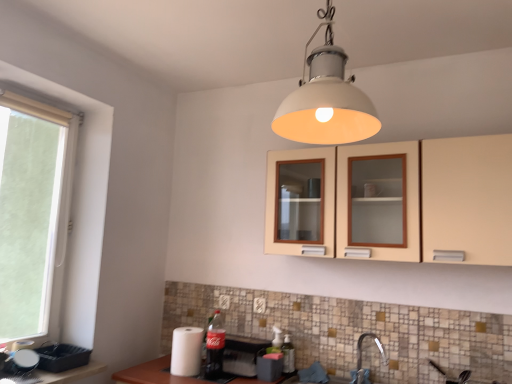
You are a GUI agent. You are given a task and a screenshot of the screen. Output one action in this format:
    pyautogui.click(x=<x>, y=<y>)
    Task: Click on the satin nickel faucet at lower center
    The height and width of the screenshot is (384, 512).
    Given the screenshot: What is the action you would take?
    pyautogui.click(x=361, y=354)

What is the approximate height of matte plastic tray at lower left?

matte plastic tray at lower left is 1.48 inches tall.

What do you see at coordinates (57, 375) in the screenshot? This screenshot has width=512, height=384. I see `matte plastic tray at lower left` at bounding box center [57, 375].

The height and width of the screenshot is (384, 512). Identify the location of white plastic electric outlet at lower center, which ranks as the first electric outlet in left-to-right order. (224, 302).

Image resolution: width=512 pixels, height=384 pixels. What do you see at coordinates (268, 367) in the screenshot? I see `matte black toaster at lower center, the 3th appliance from the left` at bounding box center [268, 367].

Where is `beige matte cabinet at upper center`? Image resolution: width=512 pixels, height=384 pixels. beige matte cabinet at upper center is located at coordinates (394, 201).

What are the coordinates of `matte black tray at lower left, acting as the first appliance starting from the left` in the screenshot? It's located at (62, 357).

Locate an element on the screen. This screenshot has height=384, width=512. satin nickel faucet at lower center is located at coordinates (361, 354).

Is beige matte cabinet at upper center oriented away from white plastic electric outlet at center, the first electric outlet in the right-to-left sequence?

beige matte cabinet at upper center is not turned away from white plastic electric outlet at center, the first electric outlet in the right-to-left sequence.

How many degrees apart are the facing directions of beige matte cabinet at upper center and white plastic electric outlet at center, the first electric outlet in the right-to-left sequence?

The angular difference between beige matte cabinet at upper center and white plastic electric outlet at center, the first electric outlet in the right-to-left sequence, is 0.0006 degrees.

Is there a large distance between beige matte cabinet at upper center and white plastic electric outlet at center, the first electric outlet in the right-to-left sequence?

No, beige matte cabinet at upper center is in close proximity to white plastic electric outlet at center, the first electric outlet in the right-to-left sequence.

Looking at this image, would you say white plastic electric outlet at center, the 2th electric outlet positioned from the left, is part of beige matte cabinet at upper center's contents?

No, white plastic electric outlet at center, the 2th electric outlet positioned from the left, is not surrounded by beige matte cabinet at upper center.

From the picture: Can you tell me how much translucent plastic bottle at lower center, which ranks as the 2th bottle in left-to-right order, and white plastic window at left differ in facing direction?

They differ by 90 degrees in their facing directions.

Considering the sizes of objects translucent plastic bottle at lower center, which is counted as the 1th bottle, starting from the right, and white plastic window at left in the image provided, who is taller, translucent plastic bottle at lower center, which is counted as the 1th bottle, starting from the right, or white plastic window at left?

white plastic window at left is taller.

Could you tell me if translucent plastic bottle at lower center, which is counted as the 1th bottle, starting from the right, is facing white plastic window at left?

No, translucent plastic bottle at lower center, which is counted as the 1th bottle, starting from the right, is not oriented towards white plastic window at left.

Between translucent plastic bottle at lower center, which ranks as the 2th bottle in left-to-right order, and white plastic window at left, which one has larger width?

Wider between the two is white plastic window at left.

Could you measure the distance between white matte lampshade at upper center and matte black toaster at lower center, arranged as the 1th appliance when viewed from the right?

white matte lampshade at upper center and matte black toaster at lower center, arranged as the 1th appliance when viewed from the right, are 4.64 feet apart from each other.

Considering the sizes of objects white matte lampshade at upper center and matte black toaster at lower center, the 3th appliance from the left, in the image provided, who is thinner, white matte lampshade at upper center or matte black toaster at lower center, the 3th appliance from the left,?

With smaller width is matte black toaster at lower center, the 3th appliance from the left.

Based on the photo, based on their sizes in the image, would you say white matte lampshade at upper center is bigger or smaller than matte black toaster at lower center, the 3th appliance from the left?

In the image, white matte lampshade at upper center appears to be larger than matte black toaster at lower center, the 3th appliance from the left.

Is matte black toaster at lower center, the 3th appliance from the left, completely or partially inside white matte lampshade at upper center?

No, matte black toaster at lower center, the 3th appliance from the left, is not surrounded by white matte lampshade at upper center.

Is point (340, 201) closer to viewer compared to point (86, 367)?

Yes, it is.

Is beige matte cabinet at upper center positioned beyond the bounds of matte plastic tray at lower left?

Absolutely, beige matte cabinet at upper center is external to matte plastic tray at lower left.

Is beige matte cabinet at upper center wider or thinner than matte plastic tray at lower left?

In the image, beige matte cabinet at upper center appears to be more narrow than matte plastic tray at lower left.

Which of these two, beige matte cabinet at upper center or matte plastic tray at lower left, stands shorter?

matte plastic tray at lower left is shorter.

Which is more to the right, translucent plastic bottle at lower center, which ranks as the 2th bottle in left-to-right order, or matte black toaster at lower center, the 3th appliance from the left?

From the viewer's perspective, translucent plastic bottle at lower center, which ranks as the 2th bottle in left-to-right order, appears more on the right side.

Which of these two, translucent plastic bottle at lower center, which ranks as the 2th bottle in left-to-right order, or matte black toaster at lower center, the 3th appliance from the left, is bigger?

matte black toaster at lower center, the 3th appliance from the left.

Identify the location of bottle on the right side of matte black toaster at lower center, the 3th appliance from the left. The width and height of the screenshot is (512, 384). (288, 355).

Is translucent plastic bottle at lower center, which is counted as the 1th bottle, starting from the right, closer to the viewer compared to matte black toaster at lower center, arranged as the 1th appliance when viewed from the right?

No.

What's the angular difference between white plastic electric outlet at lower center, which ranks as the first electric outlet in left-to-right order, and white plastic electric outlet at center, the 1th electric outlet positioned from the front,'s facing directions?

white plastic electric outlet at lower center, which ranks as the first electric outlet in left-to-right order, and white plastic electric outlet at center, the 1th electric outlet positioned from the front, are facing 0.000169 degrees away from each other.

Is white plastic electric outlet at center, the 2th electric outlet positioned from the left, at the back of white plastic electric outlet at lower center, acting as the first electric outlet starting from the back?

white plastic electric outlet at lower center, acting as the first electric outlet starting from the back, is not turned away from white plastic electric outlet at center, the 2th electric outlet positioned from the left.

Is there a large distance between white plastic electric outlet at lower center, placed as the 2th electric outlet when sorted from front to back, and white plastic electric outlet at center, the 1th electric outlet positioned from the front?

That's not correct — white plastic electric outlet at lower center, placed as the 2th electric outlet when sorted from front to back, is a little close to white plastic electric outlet at center, the 1th electric outlet positioned from the front.

Is the depth of white plastic electric outlet at lower center, which ranks as the first electric outlet in left-to-right order, less than that of white plastic electric outlet at center, the 1th electric outlet positioned from the front?

No, white plastic electric outlet at lower center, which ranks as the first electric outlet in left-to-right order, is further to the viewer.

From a real-world perspective, who is located lower, satin nickel faucet at lower center or white plastic electric outlet at lower center, which appears as the second electric outlet when viewed from the right?

From a 3D spatial view, satin nickel faucet at lower center is below.

In the image, is satin nickel faucet at lower center on the left side or the right side of white plastic electric outlet at lower center, which ranks as the first electric outlet in left-to-right order?

satin nickel faucet at lower center is positioned on white plastic electric outlet at lower center, which ranks as the first electric outlet in left-to-right order,'s right side.

Can you confirm if satin nickel faucet at lower center is smaller than white plastic electric outlet at lower center, acting as the first electric outlet starting from the back?

Incorrect, satin nickel faucet at lower center is not smaller in size than white plastic electric outlet at lower center, acting as the first electric outlet starting from the back.

Locate an element on the screen. The width and height of the screenshot is (512, 384). cabinetry above the white plastic electric outlet at center, the first electric outlet in the right-to-left sequence (from the image's perspective) is located at coordinates (394, 201).

Locate an element on the screen. bottle that is the 2nd one below the white plastic window at left (from a real-world perspective) is located at coordinates (288, 355).

Considering their positions, is white matte lampshade at upper center positioned closer to white plastic electric outlet at lower center, which ranks as the first electric outlet in left-to-right order, than matte plastic coca-cola bottle at lower center, the second bottle positioned from the right?

matte plastic coca-cola bottle at lower center, the second bottle positioned from the right.

Looking at the image, which one is located further to translucent plastic bottle at lower center, which ranks as the 2th bottle in left-to-right order, matte plastic coca-cola bottle at lower center, the first bottle when ordered from left to right, or matte black tray at lower left, acting as the first appliance starting from the left?

Among the two, matte black tray at lower left, acting as the first appliance starting from the left, is located further to translucent plastic bottle at lower center, which ranks as the 2th bottle in left-to-right order.

From the image, which object appears to be nearer to white plastic electric outlet at lower center, acting as the first electric outlet starting from the back, white plastic electric outlet at center, placed as the 2th electric outlet when sorted from back to front, or white paper towel at lower left, positioned as the 2th appliance in left-to-right order?

The object closer to white plastic electric outlet at lower center, acting as the first electric outlet starting from the back, is white plastic electric outlet at center, placed as the 2th electric outlet when sorted from back to front.

From the image, which object appears to be nearer to white paper towel at lower left, which is counted as the 2th appliance, starting from the right, translucent plastic bottle at lower center, which ranks as the 2th bottle in left-to-right order, or matte plastic coca-cola bottle at lower center, the second bottle positioned from the right?

Among the two, matte plastic coca-cola bottle at lower center, the second bottle positioned from the right, is located nearer to white paper towel at lower left, which is counted as the 2th appliance, starting from the right.

From the image, which object appears to be farther from matte black toaster at lower center, arranged as the 1th appliance when viewed from the right, matte plastic tray at lower left or white paper towel at lower left, positioned as the 2th appliance in left-to-right order?

The object further to matte black toaster at lower center, arranged as the 1th appliance when viewed from the right, is matte plastic tray at lower left.

Which object lies further to the anchor point white matte lampshade at upper center, white paper towel at lower left, which is counted as the 2th appliance, starting from the right, or white plastic window at left?

white plastic window at left is further to white matte lampshade at upper center.

Considering their positions, is matte plastic tray at lower left positioned closer to white paper towel at lower left, which is counted as the 2th appliance, starting from the right, than white matte lampshade at upper center?

Based on the image, matte plastic tray at lower left appears to be nearer to white paper towel at lower left, which is counted as the 2th appliance, starting from the right.

Consider the image. Looking at the image, which one is located closer to matte plastic tray at lower left, matte black toaster at lower center, arranged as the 1th appliance when viewed from the right, or white matte lampshade at upper center?

The object closer to matte plastic tray at lower left is matte black toaster at lower center, arranged as the 1th appliance when viewed from the right.

Identify the location of bottle between beige matte cabinet at upper center and translucent plastic bottle at lower center, which is counted as the 1th bottle, starting from the right, in the up-down direction. (215, 346).

Locate an element on the screen. This screenshot has width=512, height=384. electric outlet between matte black tray at lower left, acting as the first appliance starting from the left, and white plastic electric outlet at center, the 1th electric outlet positioned from the front, in the horizontal direction is located at coordinates (224, 302).

Find the location of a particular element. This screenshot has height=384, width=512. appliance between white paper towel at lower left, positioned as the 2th appliance in left-to-right order, and satin nickel faucet at lower center from left to right is located at coordinates click(x=268, y=367).

Where is `electric outlet between matte plastic coca-cola bottle at lower center, the second bottle positioned from the right, and white plastic electric outlet at lower center, placed as the 2th electric outlet when sorted from front to back, in the front-back direction`? This screenshot has height=384, width=512. electric outlet between matte plastic coca-cola bottle at lower center, the second bottle positioned from the right, and white plastic electric outlet at lower center, placed as the 2th electric outlet when sorted from front to back, in the front-back direction is located at coordinates (259, 305).